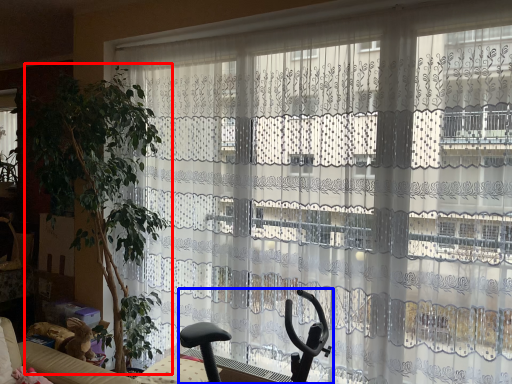
Question: Which of the following is the farthest to the observer, plant (highlighted by a red box) or swivel chair (highlighted by a blue box)?

Choices:
 (A) plant
 (B) swivel chair

Answer: (A)